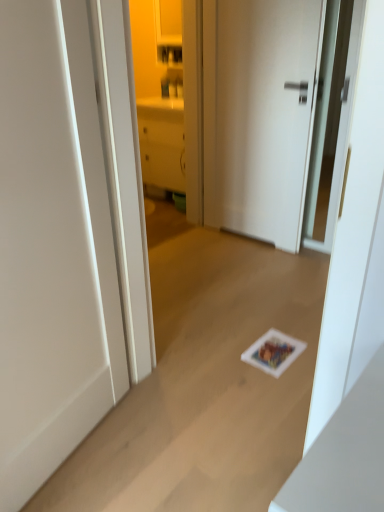
The height and width of the screenshot is (512, 384). In order to click on free space underneath white matte door at center, the 1th door when ordered from back to front (from a real-world perspective) in this screenshot , I will do `click(246, 237)`.